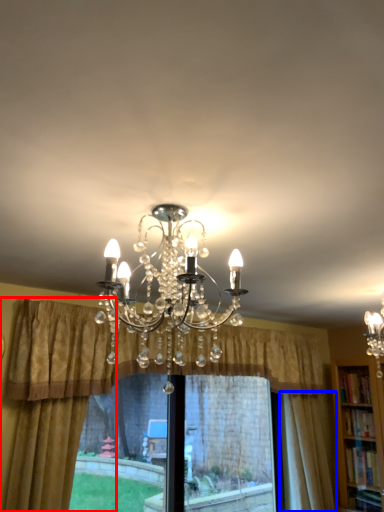
Question: Which point is further to the camera, curtain (highlighted by a red box) or curtain (highlighted by a blue box)?

Choices:
 (A) curtain
 (B) curtain

Answer: (B)